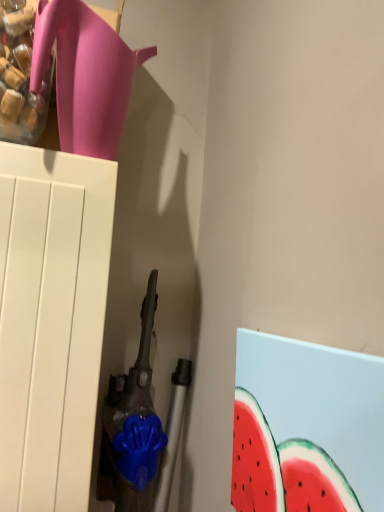
Question: Looking at the image, does watermelon painted canvas at lower right seem bigger or smaller compared to matte pink jug at upper left?

Choices:
 (A) big
 (B) small

Answer: (B)

Question: Considering the positions of point (283, 500) and point (112, 151), is point (283, 500) closer or farther from the camera than point (112, 151)?

Choices:
 (A) farther
 (B) closer

Answer: (B)

Question: Based on their positions, is watermelon painted canvas at lower right located to the left or right of matte pink jug at upper left?

Choices:
 (A) left
 (B) right

Answer: (B)

Question: From a real-world perspective, is matte pink jug at upper left positioned above or below watermelon painted canvas at lower right?

Choices:
 (A) above
 (B) below

Answer: (A)

Question: In the image, is matte pink jug at upper left on the left side or the right side of watermelon painted canvas at lower right?

Choices:
 (A) right
 (B) left

Answer: (B)

Question: Considering the positions of matte pink jug at upper left and watermelon painted canvas at lower right in the image, is matte pink jug at upper left wider or thinner than watermelon painted canvas at lower right?

Choices:
 (A) wide
 (B) thin

Answer: (A)

Question: Would you say matte pink jug at upper left is inside or outside watermelon painted canvas at lower right?

Choices:
 (A) outside
 (B) inside

Answer: (A)